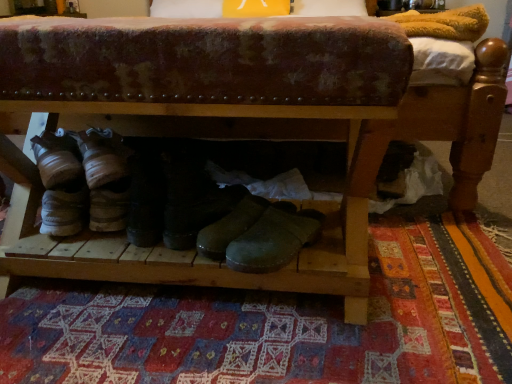
Question: Considering their positions, is black leather boots at center, the 2th footwear in the right-to-left sequence, located in front of or behind green leather boot at center, placed as the second footwear when sorted from left to right?

Choices:
 (A) behind
 (B) front

Answer: (A)

Question: Considering the positions of point (150, 178) and point (181, 231), is point (150, 178) closer or farther from the camera than point (181, 231)?

Choices:
 (A) closer
 (B) farther

Answer: (A)

Question: Which object is the closest to the black leather boots at center, the 2th footwear in the right-to-left sequence?

Choices:
 (A) patchwork rug at center
 (B) green leather boot at center, placed as the second footwear when sorted from left to right

Answer: (B)

Question: Estimate the real-world distances between objects in this image. Which object is farther from the black leather boots at center, which is the first footwear in left-to-right order?

Choices:
 (A) green leather boot at center, which is the 1th footwear from right to left
 (B) patchwork rug at center

Answer: (B)